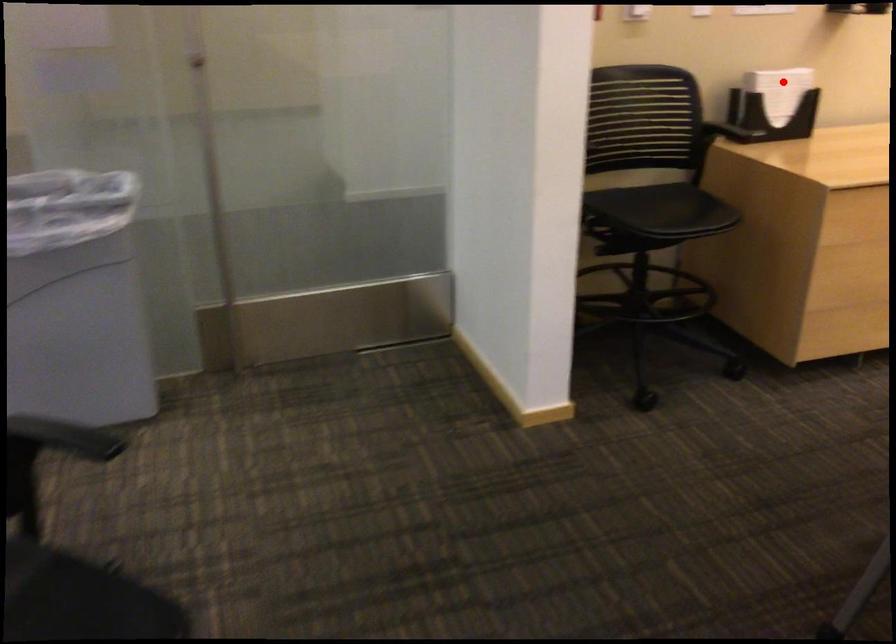
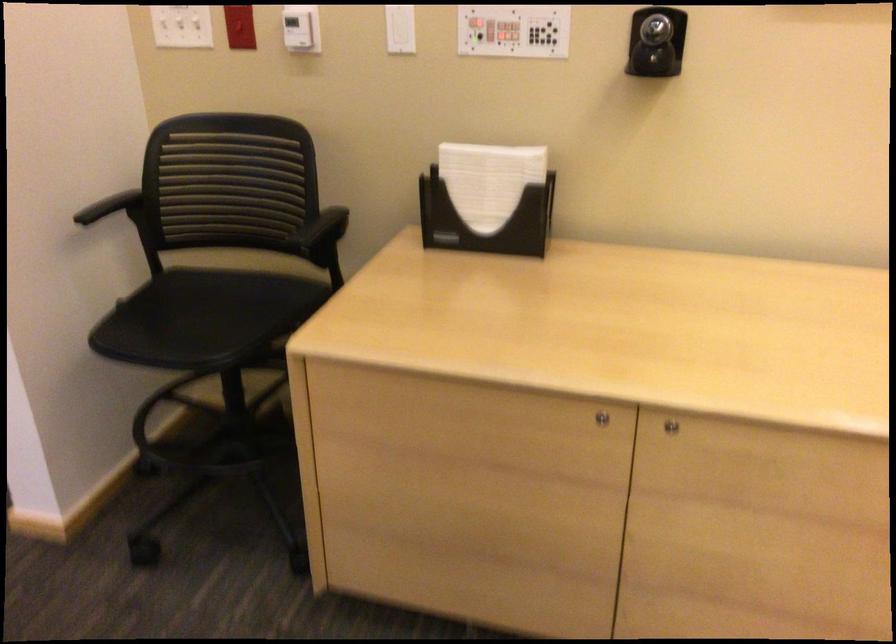
Question: I am providing you with two images of the same scene from different viewpoints. Image1 has a red point marked. In image2, the corresponding 3D location appears at what relative position? Reply with the corresponding letter.

Choices:
 (A) Closer
 (B) Farther

Answer: (A)